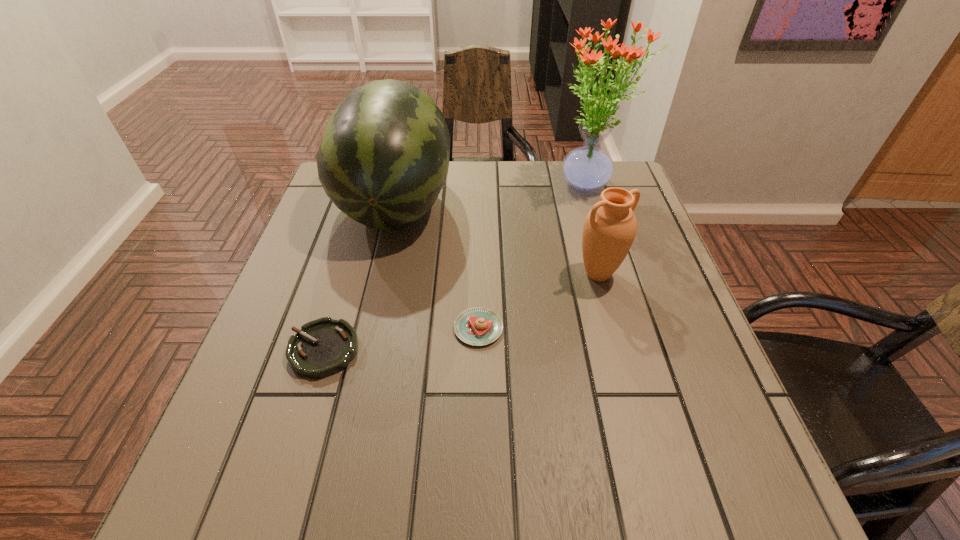
Identify the location of the tallest object. (586, 168).

Where is `the fourth shortest object`? The image size is (960, 540). the fourth shortest object is located at coordinates (384, 157).

Locate an element on the screen. the third tallest object is located at coordinates pyautogui.click(x=610, y=227).

This screenshot has width=960, height=540. I want to click on the third nearest object, so click(x=610, y=227).

In order to click on the third object from right to left in this screenshot , I will do 477,326.

Identify the location of ashtray. This screenshot has height=540, width=960. (323, 347).

Locate an element on the screen. The height and width of the screenshot is (540, 960). vacant area situated on the front of the tallest object is located at coordinates (600, 228).

What are the coordinates of `vacant area situated 0.270m on the front of the watermelon` in the screenshot? It's located at (362, 350).

Find the location of a particular element. This screenshot has width=960, height=540. free point located on the back of the third farthest object is located at coordinates (586, 226).

Where is `free space located on the left of the third object from left to right`? free space located on the left of the third object from left to right is located at coordinates (374, 328).